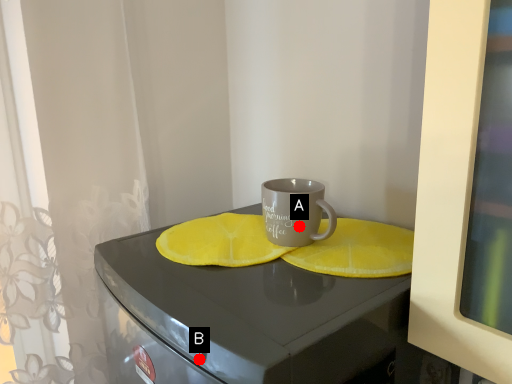
Question: Two points are circled on the image, labeled by A and B beside each circle. Among these points, which one is nearest to the camera?

Choices:
 (A) A is closer
 (B) B is closer

Answer: (B)